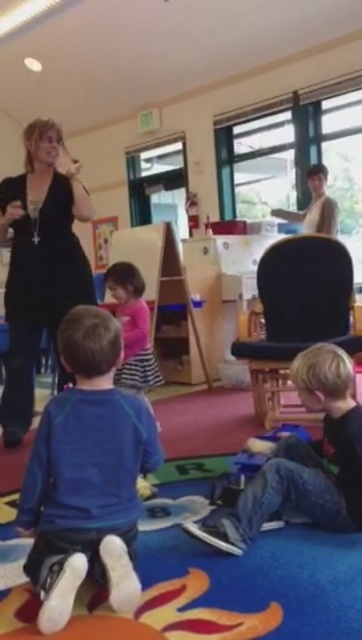
Is black matte dress at left closer to camera compared to black fabric chair at center?

No, it is not.

Between black matte dress at left and black fabric chair at center, which one has less height?

black fabric chair at center

Is point (14, 269) more distant than point (275, 396)?

No, it is in front of (275, 396).

Image resolution: width=362 pixels, height=640 pixels. What are the coordinates of `black matte dress at left` in the screenshot? It's located at (39, 260).

Does point (60, 506) lie in front of point (274, 211)?

Yes, point (60, 506) is in front of point (274, 211).

Does blue fleece jacket at lower left have a larger size compared to matte beige sweater at upper right?

Incorrect, blue fleece jacket at lower left is not larger than matte beige sweater at upper right.

The width and height of the screenshot is (362, 640). Find the location of `blue fleece jacket at lower left`. blue fleece jacket at lower left is located at coordinates (86, 474).

The height and width of the screenshot is (640, 362). I want to click on blue fleece jacket at lower left, so click(86, 474).

What do you see at coordinates (86, 474) in the screenshot?
I see `blue fleece jacket at lower left` at bounding box center [86, 474].

You are a GUI agent. You are given a task and a screenshot of the screen. Output one action in this format:
    pyautogui.click(x=<x>, y=<y>)
    Task: Click on the blue fleece jacket at lower left
    
    Given the screenshot: What is the action you would take?
    pyautogui.click(x=86, y=474)